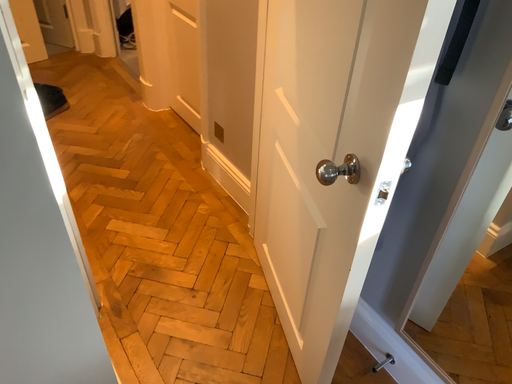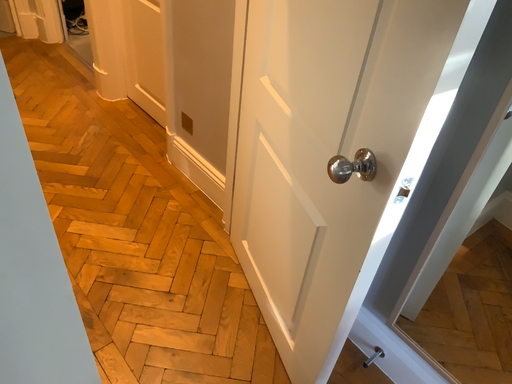
Question: How did the camera likely rotate when shooting the video?

Choices:
 (A) rotated left
 (B) rotated right

Answer: (B)